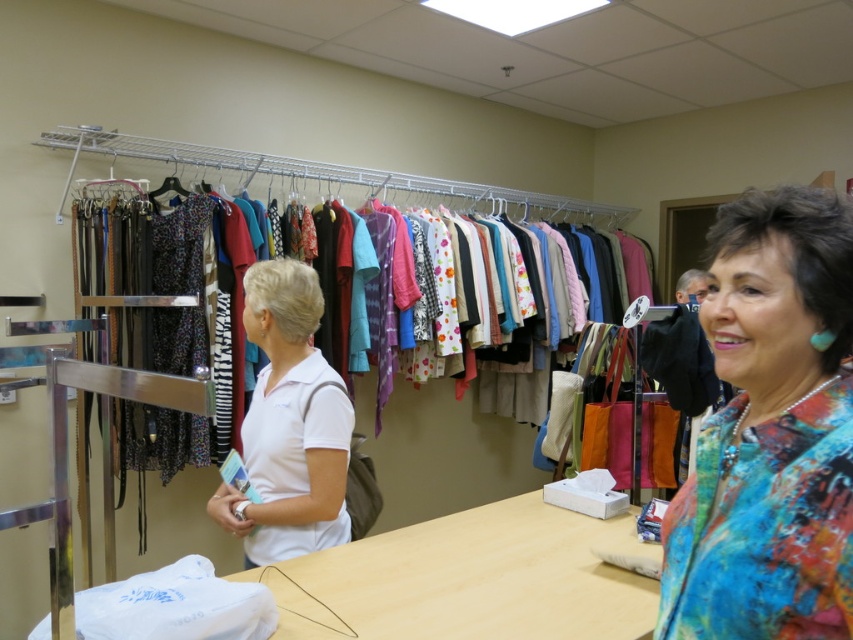
You are a photographer standing at the camera position in the scene. You want to place a small tripod on the wooden table at center. The tripod requires a minimum of 0.5 meters of space between the camera and the table to function properly. Is the current distance sufficient?

The wooden table at center and camera are 1.38 meters apart, which is more than the required 0.5 meters. Therefore, the tripod can be placed on the wooden table at center as the distance is sufficient.

You are a customer in the store and want to place your bag on the wooden table at center. However, you notice the white matte polo shirt at center is already on the table. Can you still place your bag there without moving the polo shirt?

The wooden table at center is to the right of white matte polo shirt at center, which means the polo shirt is on the table. Therefore, you cannot place your bag there without moving the polo shirt.